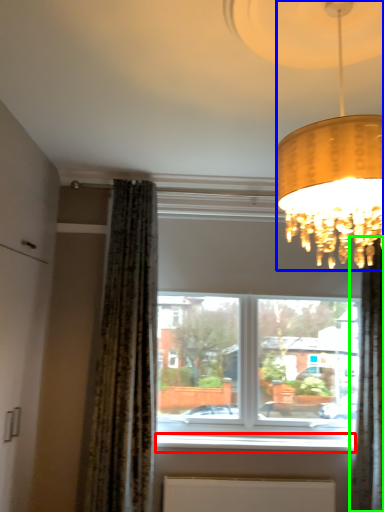
Question: Based on their relative distances, which object is nearer to window sill (highlighted by a red box)? Choose from lamp (highlighted by a blue box) and curtain (highlighted by a green box).

Choices:
 (A) lamp
 (B) curtain

Answer: (B)